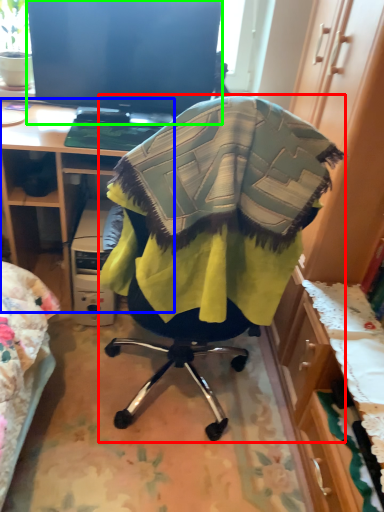
Question: Which is nearer to the chair (highlighted by a red box)? desk (highlighted by a blue box) or television (highlighted by a green box).

Choices:
 (A) desk
 (B) television

Answer: (A)